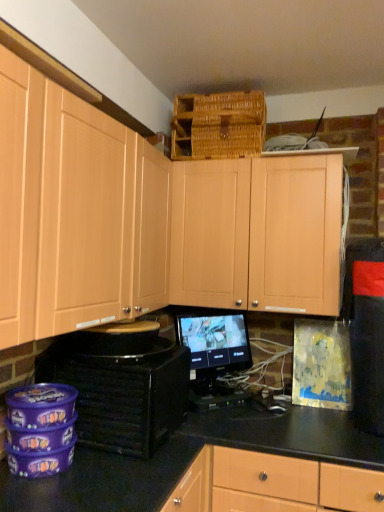
This screenshot has width=384, height=512. What do you see at coordinates (287, 433) in the screenshot?
I see `black glossy counter top at center` at bounding box center [287, 433].

Locate an element on the screen. The width and height of the screenshot is (384, 512). black matte speaker at lower left is located at coordinates (121, 388).

The height and width of the screenshot is (512, 384). What do you see at coordinates (214, 348) in the screenshot? I see `black glossy monitor at center` at bounding box center [214, 348].

Find the location of a particular element. This screenshot has height=512, width=384. matte wood cabinets at upper center, the second cabinetry in the right-to-left sequence is located at coordinates (61, 209).

Locate an element on the screen. light wood cabinet at upper center, the first cabinetry from the right is located at coordinates (257, 233).

Identify the location of black glossy counter top at center. click(287, 433).

Is light wood cabinet at upper center, acting as the 2th cabinetry starting from the left, positioned behind black matte speaker at lower left?

Yes.

Is light wood cabinet at upper center, the first cabinetry from the right, placed right next to black matte speaker at lower left?

No.

From a real-world perspective, which object rests below the other?

black matte speaker at lower left, from a real-world perspective.

Is light wood cabinet at upper center, the first cabinetry from the right, spatially inside black matte speaker at lower left, or outside of it?

The correct answer is: outside.

From a real-world perspective, does woven brown basket at upper center sit lower than black matte speaker at lower left?

No, from a real-world perspective, woven brown basket at upper center is not under black matte speaker at lower left.

Is point (224, 112) closer or farther from the camera than point (101, 371)?

Point (224, 112) appears to be farther away from the viewer than point (101, 371).

Is woven brown basket at upper center outside of black matte speaker at lower left?

woven brown basket at upper center is positioned outside black matte speaker at lower left.

How many degrees apart are the facing directions of woven brown basket at upper center and black matte speaker at lower left?

The angle between the facing direction of woven brown basket at upper center and the facing direction of black matte speaker at lower left is 88.4 degrees.

Which object is further away from the camera, woven brown basket at upper center or matte wood cabinets at upper center, the second cabinetry in the right-to-left sequence?

woven brown basket at upper center.

Can we say woven brown basket at upper center lies outside matte wood cabinets at upper center, the second cabinetry in the right-to-left sequence?

Yes, woven brown basket at upper center is located beyond the bounds of matte wood cabinets at upper center, the second cabinetry in the right-to-left sequence.

In the scene shown: From a real-world perspective, relative to matte wood cabinets at upper center, which ranks as the 1th cabinetry in left-to-right order, is woven brown basket at upper center vertically above or below?

In terms of real-world spatial position, woven brown basket at upper center is above matte wood cabinets at upper center, which ranks as the 1th cabinetry in left-to-right order.

Is woven brown basket at upper center oriented away from matte wood cabinets at upper center, which ranks as the 1th cabinetry in left-to-right order?

No.

In the scene shown: Is light wood cabinet at upper center, acting as the 2th cabinetry starting from the left, with woven brown basket at upper center?

No, light wood cabinet at upper center, acting as the 2th cabinetry starting from the left, is not in contact with woven brown basket at upper center.

Considering the relative sizes of light wood cabinet at upper center, acting as the 2th cabinetry starting from the left, and woven brown basket at upper center in the image provided, is light wood cabinet at upper center, acting as the 2th cabinetry starting from the left, shorter than woven brown basket at upper center?

Incorrect, the height of light wood cabinet at upper center, acting as the 2th cabinetry starting from the left, does not fall short of that of woven brown basket at upper center.

Between light wood cabinet at upper center, acting as the 2th cabinetry starting from the left, and woven brown basket at upper center, which one has smaller size?

With smaller size is woven brown basket at upper center.

Can woven brown basket at upper center be found inside light wood cabinet at upper center, acting as the 2th cabinetry starting from the left?

No, light wood cabinet at upper center, acting as the 2th cabinetry starting from the left, does not contain woven brown basket at upper center.

Looking at this image, does light wood cabinet at upper center, the first cabinetry from the right, lie in front of black glossy counter top at center?

No.

Which is in front, point (319, 158) or point (282, 433)?

Positioned in front is point (282, 433).

From the image's perspective, is light wood cabinet at upper center, the first cabinetry from the right, below black glossy counter top at center?

Actually, light wood cabinet at upper center, the first cabinetry from the right, appears above black glossy counter top at center in the image.

How much distance is there between light wood cabinet at upper center, acting as the 2th cabinetry starting from the left, and black glossy counter top at center?

light wood cabinet at upper center, acting as the 2th cabinetry starting from the left, and black glossy counter top at center are 27.20 inches apart from each other.

Looking at this image, who is smaller, black glossy counter top at center or black matte speaker at lower left?

With smaller size is black matte speaker at lower left.

Is black glossy counter top at center aimed at black matte speaker at lower left?

No, black glossy counter top at center is not facing towards black matte speaker at lower left.

Considering the relative positions of black glossy counter top at center and black matte speaker at lower left in the image provided, is black glossy counter top at center to the left or to the right of black matte speaker at lower left?

From the image, it's evident that black glossy counter top at center is to the right of black matte speaker at lower left.

Is matte wood cabinets at upper center, the second cabinetry in the right-to-left sequence, closer to camera compared to black glossy counter top at center?

That is True.

Which is in front, point (37, 217) or point (344, 460)?

The point (37, 217) is closer.

Considering the relative positions of matte wood cabinets at upper center, the second cabinetry in the right-to-left sequence, and black glossy counter top at center in the image provided, is matte wood cabinets at upper center, the second cabinetry in the right-to-left sequence, to the right of black glossy counter top at center from the viewer's perspective?

No.

From the image's perspective, which is above, matte wood cabinets at upper center, which ranks as the 1th cabinetry in left-to-right order, or black glossy counter top at center?

From the image's view, matte wood cabinets at upper center, which ranks as the 1th cabinetry in left-to-right order, is above.

Identify the location of appliance below the light wood cabinet at upper center, the first cabinetry from the right (from the image's perspective). (121, 388).

Identify the location of basket lying on the right of black matte speaker at lower left. This screenshot has height=512, width=384. (218, 125).

Considering their positions, is black glossy counter top at center positioned further to matte wood cabinets at upper center, the second cabinetry in the right-to-left sequence, than light wood cabinet at upper center, acting as the 2th cabinetry starting from the left?

The object further to matte wood cabinets at upper center, the second cabinetry in the right-to-left sequence, is black glossy counter top at center.

Estimate the real-world distances between objects in this image. Which object is closer to black glossy counter top at center, black glossy monitor at center or light wood cabinet at upper center, acting as the 2th cabinetry starting from the left?

The object closer to black glossy counter top at center is black glossy monitor at center.

Which object lies nearer to the anchor point black matte speaker at lower left, matte wood cabinets at upper center, the second cabinetry in the right-to-left sequence, or black glossy monitor at center?

matte wood cabinets at upper center, the second cabinetry in the right-to-left sequence, is positioned closer to the anchor black matte speaker at lower left.

Which object lies nearer to the anchor point light wood cabinet at upper center, acting as the 2th cabinetry starting from the left, matte wood cabinets at upper center, which ranks as the 1th cabinetry in left-to-right order, or black glossy counter top at center?

Based on the image, black glossy counter top at center appears to be nearer to light wood cabinet at upper center, acting as the 2th cabinetry starting from the left.

Considering their positions, is light wood cabinet at upper center, the first cabinetry from the right, positioned further to woven brown basket at upper center than matte wood cabinets at upper center, which ranks as the 1th cabinetry in left-to-right order?

matte wood cabinets at upper center, which ranks as the 1th cabinetry in left-to-right order, lies further to woven brown basket at upper center than the other object.

Considering their positions, is matte wood cabinets at upper center, which ranks as the 1th cabinetry in left-to-right order, positioned closer to woven brown basket at upper center than black matte speaker at lower left?

matte wood cabinets at upper center, which ranks as the 1th cabinetry in left-to-right order, is positioned closer to the anchor woven brown basket at upper center.

Based on their spatial positions, is woven brown basket at upper center or black matte speaker at lower left further from matte wood cabinets at upper center, which ranks as the 1th cabinetry in left-to-right order?

Based on the image, woven brown basket at upper center appears to be further to matte wood cabinets at upper center, which ranks as the 1th cabinetry in left-to-right order.

From the image, which object appears to be farther from matte wood cabinets at upper center, which ranks as the 1th cabinetry in left-to-right order, woven brown basket at upper center or light wood cabinet at upper center, acting as the 2th cabinetry starting from the left?

woven brown basket at upper center.

This screenshot has width=384, height=512. Identify the location of computer monitor between light wood cabinet at upper center, acting as the 2th cabinetry starting from the left, and black matte speaker at lower left in the up-down direction. (214, 348).

Where is `computer monitor between black matte speaker at lower left and black glossy counter top at center from left to right`? The image size is (384, 512). computer monitor between black matte speaker at lower left and black glossy counter top at center from left to right is located at coordinates point(214,348).

The width and height of the screenshot is (384, 512). Find the location of `cabinetry between matte wood cabinets at upper center, which ranks as the 1th cabinetry in left-to-right order, and black glossy monitor at center, along the z-axis`. cabinetry between matte wood cabinets at upper center, which ranks as the 1th cabinetry in left-to-right order, and black glossy monitor at center, along the z-axis is located at coordinates (257, 233).

Image resolution: width=384 pixels, height=512 pixels. In order to click on appliance between matte wood cabinets at upper center, which ranks as the 1th cabinetry in left-to-right order, and black glossy monitor at center from front to back in this screenshot , I will do `click(121, 388)`.